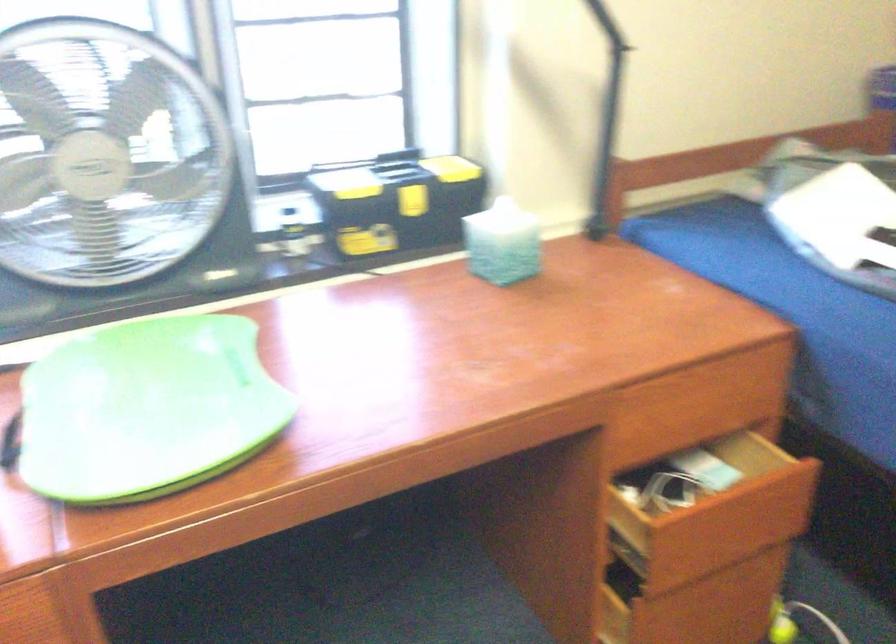
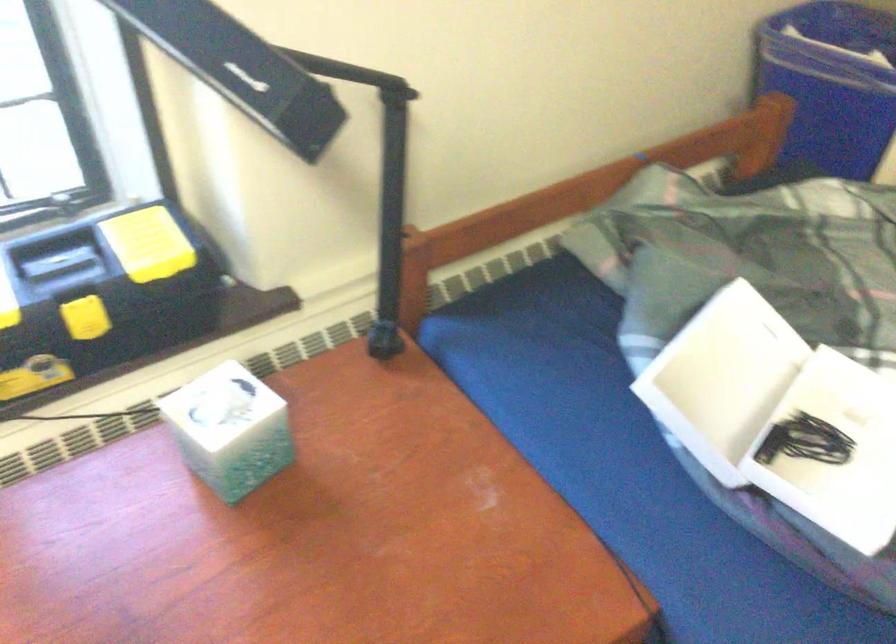
Question: In a continuous first-person perspective shot, in which direction is the camera moving?

Choices:
 (A) Left
 (B) Right
 (C) Forward
 (D) Backward

Answer: (C)